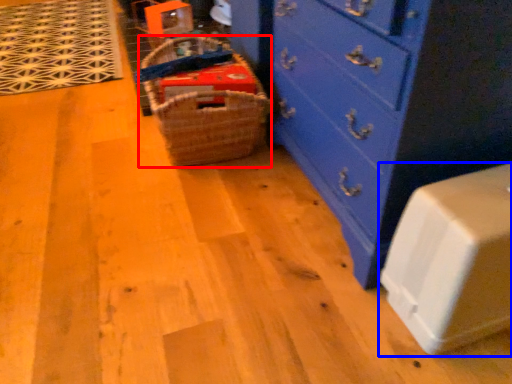
Question: Which point is further to the camera, basket (highlighted by a red box) or cabinetry (highlighted by a blue box)?

Choices:
 (A) basket
 (B) cabinetry

Answer: (A)